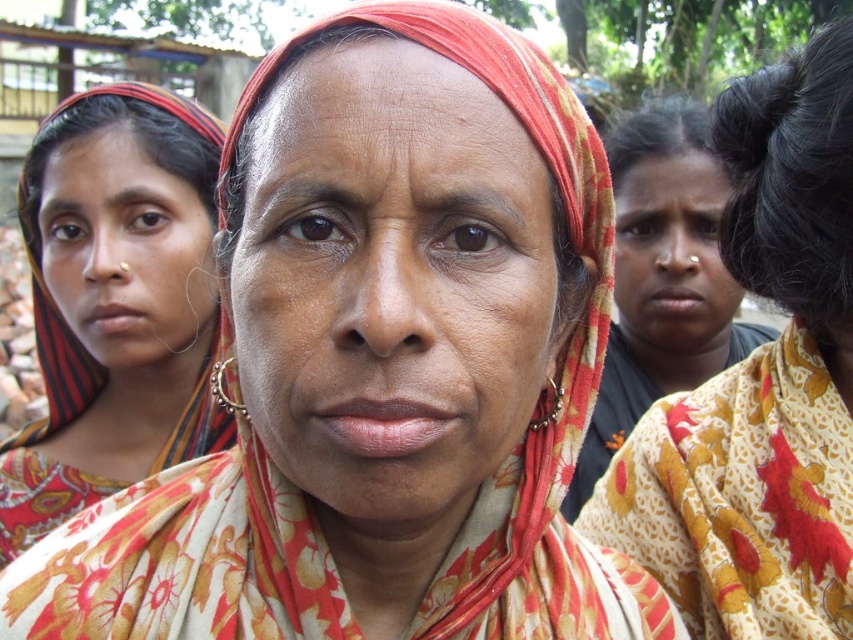
Question: Which point is closer to the camera?

Choices:
 (A) (171, 209)
 (B) (693, 618)
 (C) (238, 170)

Answer: (C)

Question: Which point appears farthest from the camera in this image?

Choices:
 (A) (689, 211)
 (B) (799, 598)
 (C) (262, 76)
 (D) (310, 435)

Answer: (A)

Question: Is matte black face at left to the right of dry skin at center from the viewer's perspective?

Choices:
 (A) no
 (B) yes

Answer: (A)

Question: Considering the relative positions of matte black saree at left and matte black face at left in the image provided, where is matte black saree at left located with respect to matte black face at left?

Choices:
 (A) right
 (B) left

Answer: (B)

Question: Which point appears farthest from the camera in this image?

Choices:
 (A) (231, 141)
 (B) (115, 460)
 (C) (730, 529)

Answer: (B)

Question: Is matte floral scarf at center to the left of floral fabric scarf at center from the viewer's perspective?

Choices:
 (A) no
 (B) yes

Answer: (B)